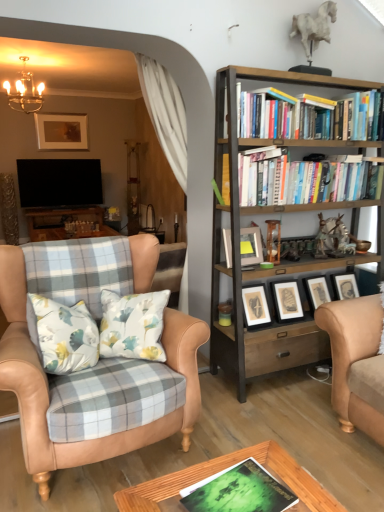
You are a GUI agent. You are given a task and a screenshot of the screen. Output one action in this format:
    pyautogui.click(x=<x>, y=<y>)
    Task: Click on the tan leather chair at left
    This screenshot has height=512, width=384.
    Given the screenshot: What is the action you would take?
    pyautogui.click(x=48, y=390)

In order to click on matte gold picture frame at upper center, placed as the second picture frame when sorted from right to left in this screenshot , I will do `click(61, 131)`.

Identify the location of matte gray picture frame at center, placed as the 2th picture frame when sorted from back to front. (250, 246).

How much space does matte gray picture frame at center, which is the 1th picture frame in bottom-to-top order, occupy vertically?

matte gray picture frame at center, which is the 1th picture frame in bottom-to-top order, is 9.60 inches tall.

What do you see at coordinates (300, 180) in the screenshot? The width and height of the screenshot is (384, 512). I see `hardcover books at upper right, the second book in the left-to-right sequence` at bounding box center [300, 180].

This screenshot has width=384, height=512. I want to click on tan leather chair at left, so click(48, 390).

Considering the positions of objects metallic chandelier at upper left and green matte book at center, which is counted as the first book, starting from the front, in the image provided, who is behind, metallic chandelier at upper left or green matte book at center, which is counted as the first book, starting from the front,?

metallic chandelier at upper left is behind.

Does metallic chandelier at upper left appear on the left side of green matte book at center, the 2th book from the top?

Yes, metallic chandelier at upper left is to the left of green matte book at center, the 2th book from the top.

From the image's perspective, is metallic chandelier at upper left on green matte book at center, marked as the 1th book in a left-to-right arrangement?

Correct, metallic chandelier at upper left appears higher than green matte book at center, marked as the 1th book in a left-to-right arrangement, in the image.

Locate an element on the screen. book that is the 2nd one when counting forward from the metallic chandelier at upper left is located at coordinates (239, 490).

Is hardcover books at upper right, arranged as the second book when viewed from the front, touching metallic chandelier at upper left?

No, hardcover books at upper right, arranged as the second book when viewed from the front, is not making contact with metallic chandelier at upper left.

Who is bigger, hardcover books at upper right, placed as the first book when sorted from right to left, or metallic chandelier at upper left?

metallic chandelier at upper left is bigger.

Is the position of hardcover books at upper right, placed as the first book when sorted from right to left, more distant than that of metallic chandelier at upper left?

That is False.

Is hardcover books at upper right, placed as the first book when sorted from right to left, not near matte gold picture frame at upper center, the 2th picture frame from the front?

Yes, hardcover books at upper right, placed as the first book when sorted from right to left, and matte gold picture frame at upper center, the 2th picture frame from the front, are located far from each other.

Is hardcover books at upper right, arranged as the second book when viewed from the front, positioned behind matte gold picture frame at upper center, the first picture frame viewed from the left?

No, it is not.

Is hardcover books at upper right, the second book in the left-to-right sequence, taller or shorter than matte gold picture frame at upper center, the first picture frame viewed from the left?

Considering their sizes, hardcover books at upper right, the second book in the left-to-right sequence, has less height than matte gold picture frame at upper center, the first picture frame viewed from the left.

From the image's perspective, count 1st books downward from the matte gold picture frame at upper center, placed as the 2th picture frame when sorted from bottom to top, and point to it. Please provide its 2D coordinates.

[(300, 180)]

Is tan leather chair at left looking in the opposite direction of green matte book at center, the 2th book positioned from the back?

No.

Is point (147, 273) behind point (197, 507)?

Yes, it is.

Which object is closer to the camera, tan leather chair at left or green matte book at center, which is counted as the first book, starting from the front?

green matte book at center, which is counted as the first book, starting from the front, is in front.

Identify the location of chair behind the green matte book at center, the 2th book positioned from the back. (48, 390).

Which of these two, green matte book at center, the 2th book from the top, or hardcover books at upper right, which is the first book in top-to-bottom order, is wider?

With larger width is green matte book at center, the 2th book from the top.

Can you confirm if green matte book at center, which is counted as the first book, starting from the front, is positioned to the right of hardcover books at upper right, placed as the first book when sorted from right to left?

Incorrect, green matte book at center, which is counted as the first book, starting from the front, is not on the right side of hardcover books at upper right, placed as the first book when sorted from right to left.

From a real-world perspective, is green matte book at center, the 2th book positioned from the back, physically above hardcover books at upper right, placed as the first book when sorted from right to left?

No, from a real-world perspective, green matte book at center, the 2th book positioned from the back, is not on top of hardcover books at upper right, placed as the first book when sorted from right to left.

Do you think green matte book at center, which is the 1th book in bottom-to-top order, is within hardcover books at upper right, the second book in the left-to-right sequence, or outside of it?

green matte book at center, which is the 1th book in bottom-to-top order, exists outside the volume of hardcover books at upper right, the second book in the left-to-right sequence.

From a real-world perspective, which object stands above the other?

wooden bookshelf at right is physically above.

Is wooden bookshelf at right beside green matte book at center, placed as the second book when sorted from right to left?

No, wooden bookshelf at right is not touching green matte book at center, placed as the second book when sorted from right to left.

Can you confirm if wooden bookshelf at right is shorter than green matte book at center, the 2th book positioned from the back?

In fact, wooden bookshelf at right may be taller than green matte book at center, the 2th book positioned from the back.

Is metallic chandelier at upper left bigger than matte gray picture frame at center, which appears as the 1th picture frame when viewed from the front?

Yes.

Considering the relative sizes of metallic chandelier at upper left and matte gray picture frame at center, the second picture frame in the top-to-bottom sequence, in the image provided, is metallic chandelier at upper left thinner than matte gray picture frame at center, the second picture frame in the top-to-bottom sequence,?

In fact, metallic chandelier at upper left might be wider than matte gray picture frame at center, the second picture frame in the top-to-bottom sequence.

Is metallic chandelier at upper left located outside matte gray picture frame at center, the second picture frame in the top-to-bottom sequence?

That's correct, metallic chandelier at upper left is outside of matte gray picture frame at center, the second picture frame in the top-to-bottom sequence.

Is metallic chandelier at upper left aimed at matte gray picture frame at center, the second picture frame in the top-to-bottom sequence?

Yes, metallic chandelier at upper left is oriented towards matte gray picture frame at center, the second picture frame in the top-to-bottom sequence.

Locate an element on the screen. Image resolution: width=384 pixels, height=512 pixels. the 2nd book in front of the metallic chandelier at upper left is located at coordinates (239, 490).

At what (x,y) coordinates should I click in order to perform the action: click on lamp behind the hardcover books at upper right, placed as the first book when sorted from right to left. Please return your answer as a coordinate pair (x, y). Image resolution: width=384 pixels, height=512 pixels. Looking at the image, I should click on (25, 92).

Estimate the real-world distances between objects in this image. Which object is further from hardcover books at upper right, arranged as the second book when viewed from the front, tan leather chair at left or metallic chandelier at upper left?

metallic chandelier at upper left lies further to hardcover books at upper right, arranged as the second book when viewed from the front, than the other object.

Which object lies nearer to the anchor point green matte book at center, which is counted as the first book, starting from the front, matte gold picture frame at upper center, placed as the 2th picture frame when sorted from bottom to top, or metallic chandelier at upper left?

Based on the image, metallic chandelier at upper left appears to be nearer to green matte book at center, which is counted as the first book, starting from the front.

Estimate the real-world distances between objects in this image. Which object is closer to tan leather chair at left, matte gold picture frame at upper center, the first picture frame positioned from the back, or green matte book at center, the 2th book positioned from the back?

Based on the image, green matte book at center, the 2th book positioned from the back, appears to be nearer to tan leather chair at left.

When comparing their distances from hardcover books at upper right, which is the second book from bottom to top, does wooden bookshelf at right or green matte book at center, the 2th book from the top, seem further?

green matte book at center, the 2th book from the top, lies further to hardcover books at upper right, which is the second book from bottom to top, than the other object.

Looking at the image, which one is located closer to tan leather chair at left, hardcover books at upper right, arranged as the second book when viewed from the front, or wooden bookshelf at right?

Based on the image, wooden bookshelf at right appears to be nearer to tan leather chair at left.

Considering their positions, is tan leather chair at left positioned closer to wooden bookshelf at right than matte gray picture frame at center, which is the 1th picture frame from right to left?

matte gray picture frame at center, which is the 1th picture frame from right to left.

Considering their positions, is matte gold picture frame at upper center, placed as the second picture frame when sorted from right to left, positioned further to wooden bookshelf at right than metallic chandelier at upper left?

matte gold picture frame at upper center, placed as the second picture frame when sorted from right to left, lies further to wooden bookshelf at right than the other object.

Which object lies further to the anchor point matte gold picture frame at upper center, the 2th picture frame from the front, wooden bookshelf at right or hardcover books at upper right, arranged as the second book when viewed from the front?

The object further to matte gold picture frame at upper center, the 2th picture frame from the front, is hardcover books at upper right, arranged as the second book when viewed from the front.

Image resolution: width=384 pixels, height=512 pixels. I want to click on chair between green matte book at center, the 2th book positioned from the back, and matte gold picture frame at upper center, placed as the 2th picture frame when sorted from bottom to top, in the front-back direction, so click(x=48, y=390).

Find the location of a particular element. Image resolution: width=384 pixels, height=512 pixels. bookcase situated between matte gray picture frame at center, which appears as the second picture frame when viewed from the left, and hardcover books at upper right, which is the first book in top-to-bottom order, from left to right is located at coordinates (238, 200).

At what (x,y) coordinates should I click in order to perform the action: click on book located between tan leather chair at left and wooden bookshelf at right in the left-right direction. Please return your answer as a coordinate pair (x, y). Looking at the image, I should click on (239, 490).

Where is `picture frame between metallic chandelier at upper left and wooden bookshelf at right in the horizontal direction`? The width and height of the screenshot is (384, 512). picture frame between metallic chandelier at upper left and wooden bookshelf at right in the horizontal direction is located at coordinates (250, 246).